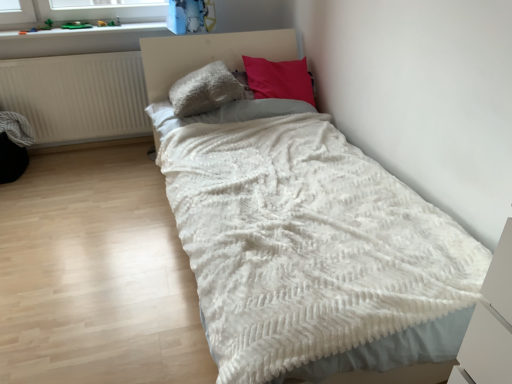
The width and height of the screenshot is (512, 384). What are the coordinates of `empty space that is ontop of smooth plastic toys at upper left` in the screenshot? It's located at (88, 29).